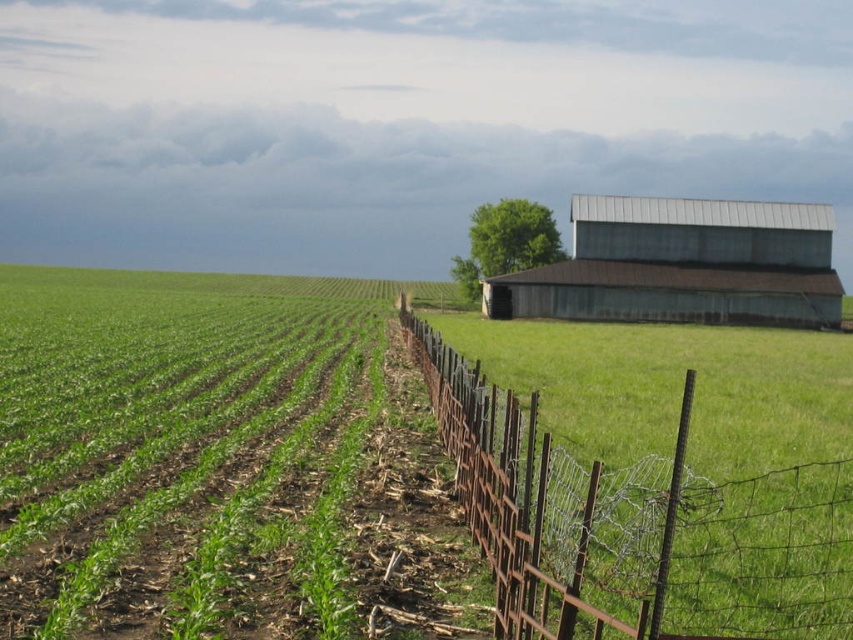
You are standing in the middle of the field and want to walk to the barn. Which object, the rusty wire fence at right or the rusty corrugated metal barn at right, is closer to you?

The rusty wire fence at right is closer to the viewer than the rusty corrugated metal barn at right, so you would reach the rusty wire fence at right first before reaching the barn.